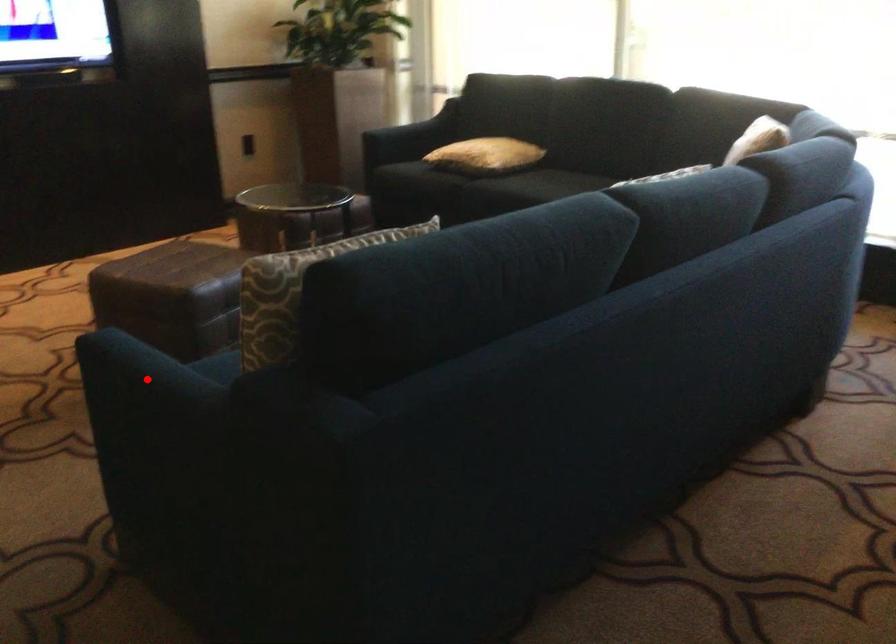
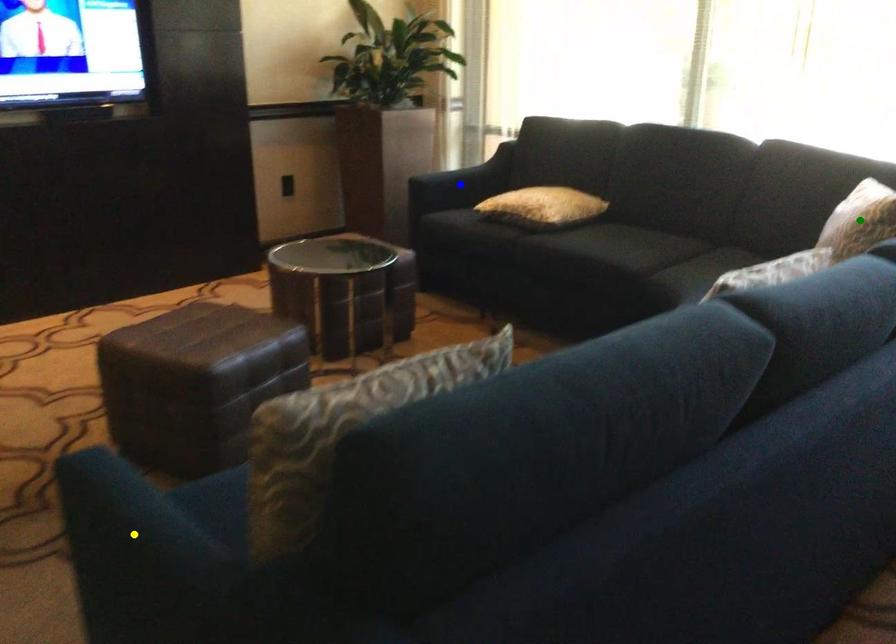
Question: I am providing you with two images of the same scene from different viewpoints. A red point is marked on the first image. You are given multiple points on the second image. Which point in image 2 is actually the same real-world point as the red point in image 1?

Choices:
 (A) yellow point
 (B) blue point
 (C) green point

Answer: (A)